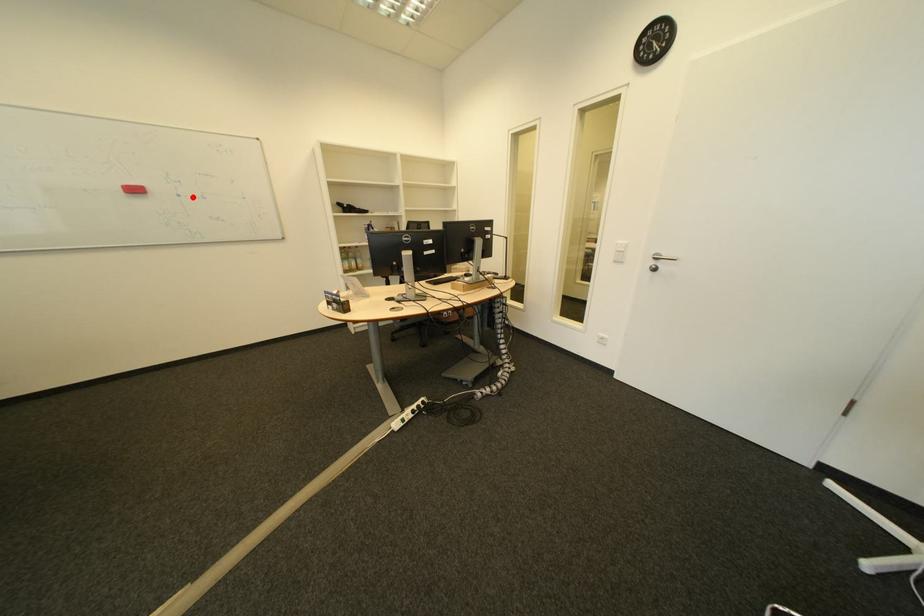
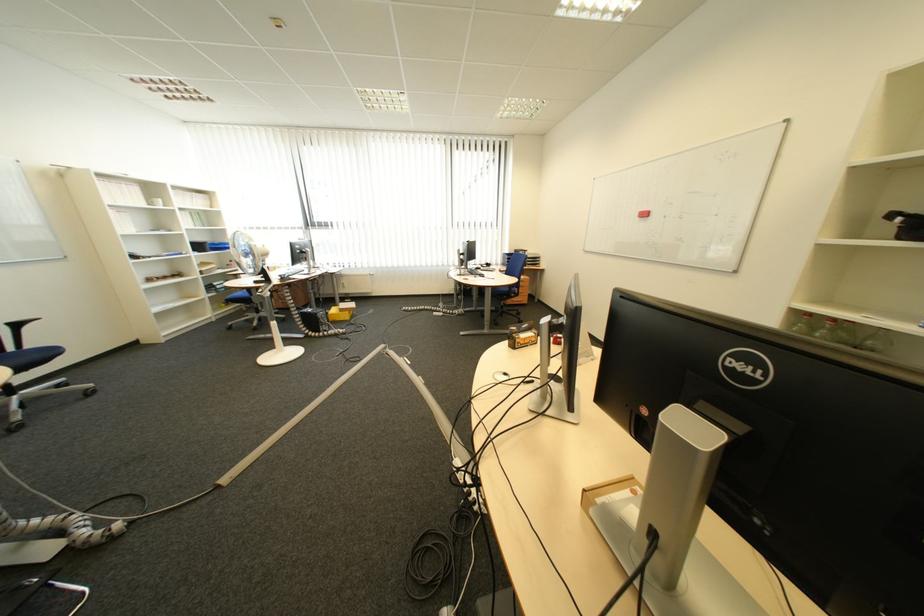
Where in the second image is the point corresponding to the highlighted location from the first image?

(677, 217)